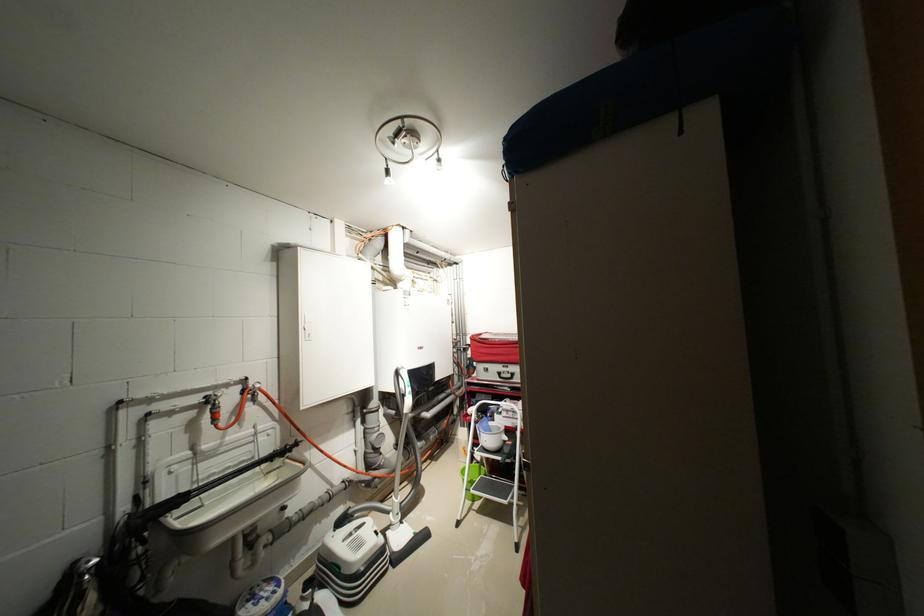
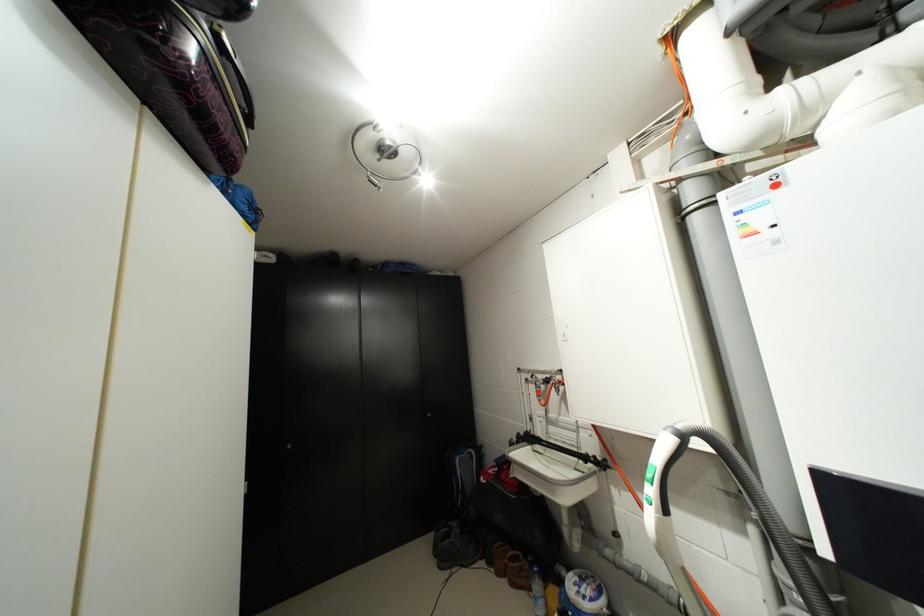
The point at [286,585] is marked in the first image. Where is the corresponding point in the second image?

(599, 600)